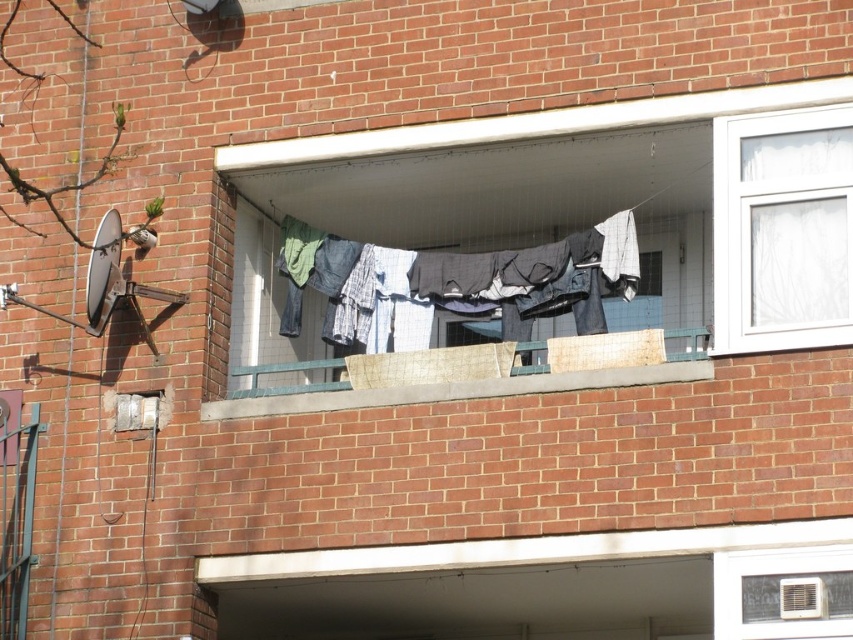
You are a painter who needs to know which object is taller between the white plastic window at upper right and the wooden planks at center. Based on the scene, which one is taller?

The white plastic window at upper right is much taller than the wooden planks at center according to the description.

You are a painter who needs to reach both the white plastic window at upper right and the wooden planks at center. You have a ladder that is 10 feet long. Can you safely place the ladder between these two objects to reach them without moving it?

The white plastic window at upper right and wooden planks at center are 9.98 feet apart, so the ladder can be placed between them since its length is sufficient to span the distance between them.

You are standing on the ground floor of the building and looking up at the balcony. Which object is higher up between the blue cotton clothes at center and the wooden planks at center?

The blue cotton clothes at center is above the wooden planks at center, so the blue cotton clothes at center is higher up.